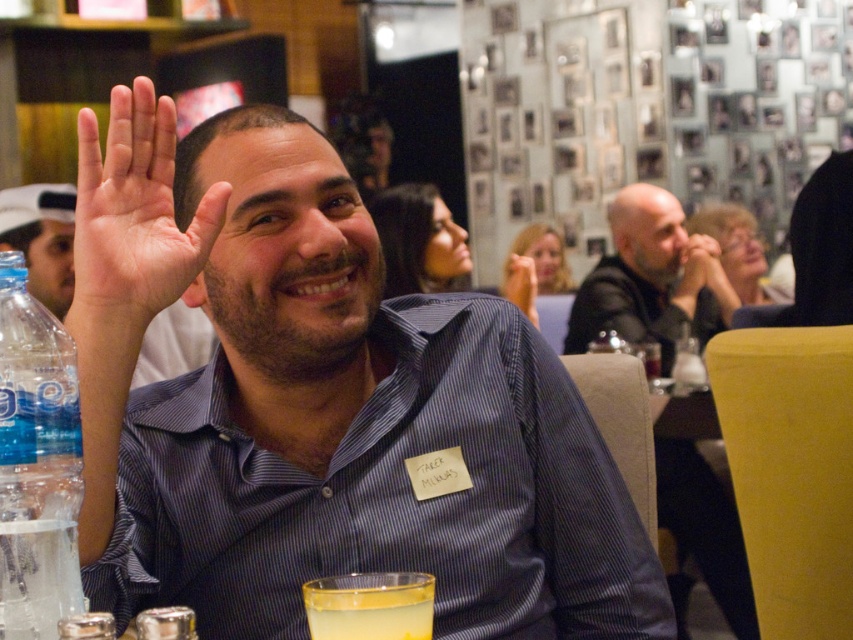
You are a bartender at this event and need to pour the yellow translucent liquid at lower center into the clear plastic bottle at lower left. Will the bottle be able to hold all the liquid?

The yellow translucent liquid at lower center is larger in size than clear plastic bottle at lower left, so pouring the liquid into the bottle will cause it to overflow.

You are at a social event and want to move from your current position to the exit located at point (61, 628). There is an obstacle at point (718, 536). Based on the scene description, can you safely walk around the obstacle to reach the exit?

Point (718, 536) is behind point (61, 628), so the obstacle is located behind the exit. Therefore, you can safely walk towards the exit without needing to go around the obstacle since it is not in your path.

You are organizing a charity event and need to ensure all participants have enough space to move around. The matte black shirt at center and the clear plastic bottle at lower left are in the same area. Considering their sizes, which object might require more space for someone to navigate around?

The matte black shirt at center requires more space to navigate around because its width is greater than the clear plastic bottle at lower left.